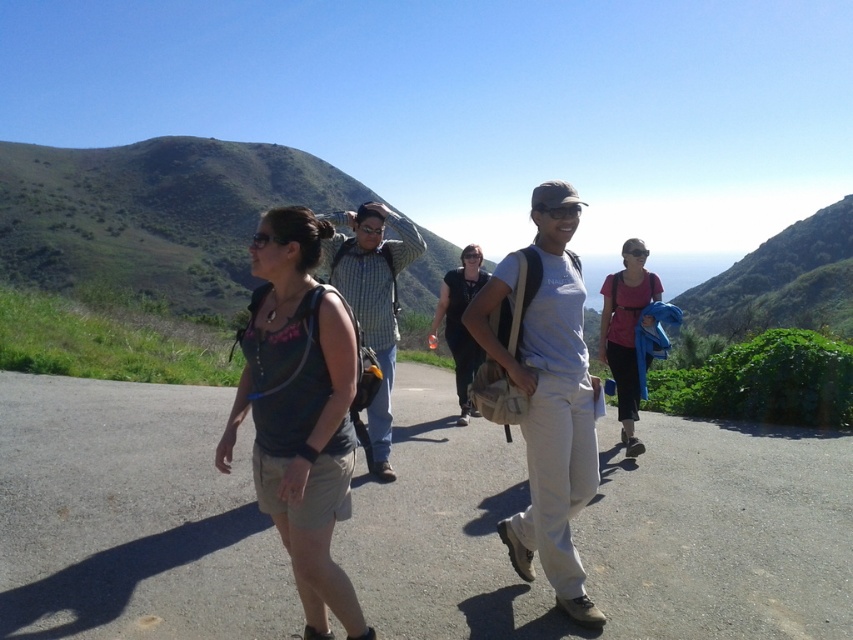
Can you confirm if gray asphalt road at center is bigger than matte black tank top at center?

Actually, gray asphalt road at center might be smaller than matte black tank top at center.

Who is positioned more to the left, gray asphalt road at center or matte black tank top at center?

gray asphalt road at center is more to the left.

Between point (434, 493) and point (305, 461), which one is positioned behind?

The point (434, 493) is more distant.

At what (x,y) coordinates should I click in order to perform the action: click on gray asphalt road at center. Please return your answer as a coordinate pair (x, y). The image size is (853, 640). Looking at the image, I should click on (131, 516).

Between point (381, 525) and point (653, 282), which one is positioned in front?

Point (381, 525) is more forward.

What do you see at coordinates (131, 516) in the screenshot? This screenshot has width=853, height=640. I see `gray asphalt road at center` at bounding box center [131, 516].

This screenshot has width=853, height=640. I want to click on gray asphalt road at center, so click(131, 516).

Is point (769, 604) positioned in front of point (456, 296)?

Yes, it is in front of point (456, 296).

Who is positioned more to the left, gray asphalt road at center or light gray cotton shirt at center?

gray asphalt road at center is more to the left.

Is point (666, 612) behind point (460, 342)?

No.

Find the location of a particular element. Image resolution: width=853 pixels, height=640 pixels. gray asphalt road at center is located at coordinates (131, 516).